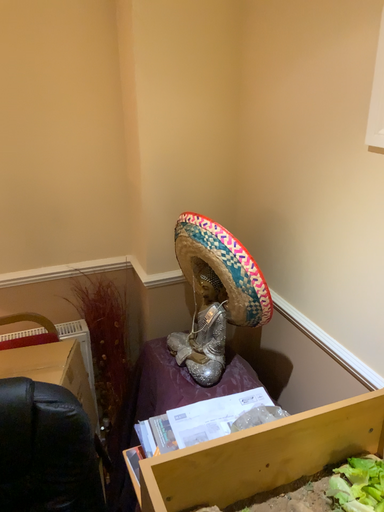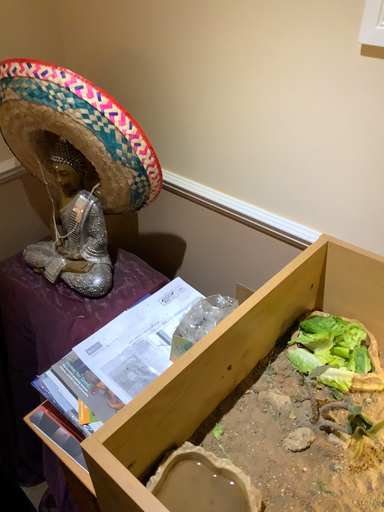
Question: How did the camera likely rotate when shooting the video?

Choices:
 (A) rotated left
 (B) rotated right

Answer: (B)